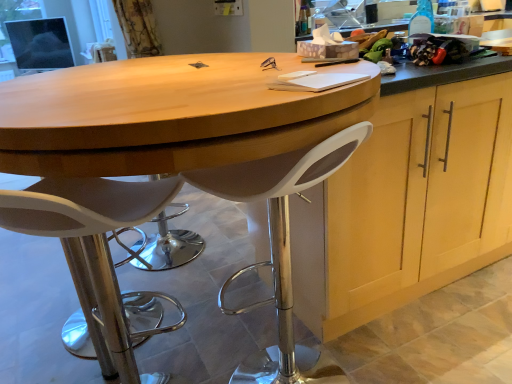
Question: Can you confirm if white plastic stool at center, which is the first chair from right to left, is shorter than wooden table at center?

Choices:
 (A) yes
 (B) no

Answer: (A)

Question: Can you confirm if white plastic stool at center, the second chair viewed from the left, is bigger than wooden table at center?

Choices:
 (A) no
 (B) yes

Answer: (A)

Question: From a real-world perspective, is white plastic stool at center, which is the first chair from right to left, physically above wooden table at center?

Choices:
 (A) yes
 (B) no

Answer: (B)

Question: Can you confirm if white plastic stool at center, the second chair viewed from the left, is smaller than wooden table at center?

Choices:
 (A) yes
 (B) no

Answer: (A)

Question: Does white plastic stool at center, which is the first chair from right to left, have a greater width compared to wooden table at center?

Choices:
 (A) yes
 (B) no

Answer: (B)

Question: From the image's perspective, relative to wooden table at center, is white plastic stool at center, which is the first chair from right to left, above or below?

Choices:
 (A) below
 (B) above

Answer: (A)

Question: Visually, is white plastic stool at center, which is the first chair from right to left, positioned to the left or to the right of wooden table at center?

Choices:
 (A) left
 (B) right

Answer: (B)

Question: Looking at their shapes, would you say white plastic stool at center, which is the first chair from right to left, is wider or thinner than wooden table at center?

Choices:
 (A) thin
 (B) wide

Answer: (A)

Question: Is white plastic stool at center, which is the first chair from right to left, in front of or behind wooden table at center in the image?

Choices:
 (A) front
 (B) behind

Answer: (B)

Question: From their relative heights in the image, would you say white plastic stool at center, which is the first chair from right to left, is taller or shorter than white plastic stool at lower left, positioned as the second chair in right-to-left order?

Choices:
 (A) tall
 (B) short

Answer: (A)

Question: From the image's perspective, is white plastic stool at center, which is the first chair from right to left, located above or below white plastic stool at lower left, positioned as the second chair in right-to-left order?

Choices:
 (A) above
 (B) below

Answer: (A)

Question: Is white plastic stool at center, which is the first chair from right to left, spatially inside white plastic stool at lower left, positioned as the second chair in right-to-left order, or outside of it?

Choices:
 (A) inside
 (B) outside

Answer: (B)

Question: Considering their positions, is white plastic stool at center, the second chair viewed from the left, located in front of or behind white plastic stool at lower left, positioned as the 1th chair in left-to-right order?

Choices:
 (A) behind
 (B) front

Answer: (A)

Question: Relative to white plastic stool at center, the second chair viewed from the left, is wooden table at center in front or behind?

Choices:
 (A) behind
 (B) front

Answer: (B)

Question: From a real-world perspective, is wooden table at center physically located above or below white plastic stool at center, the second chair viewed from the left?

Choices:
 (A) below
 (B) above

Answer: (B)